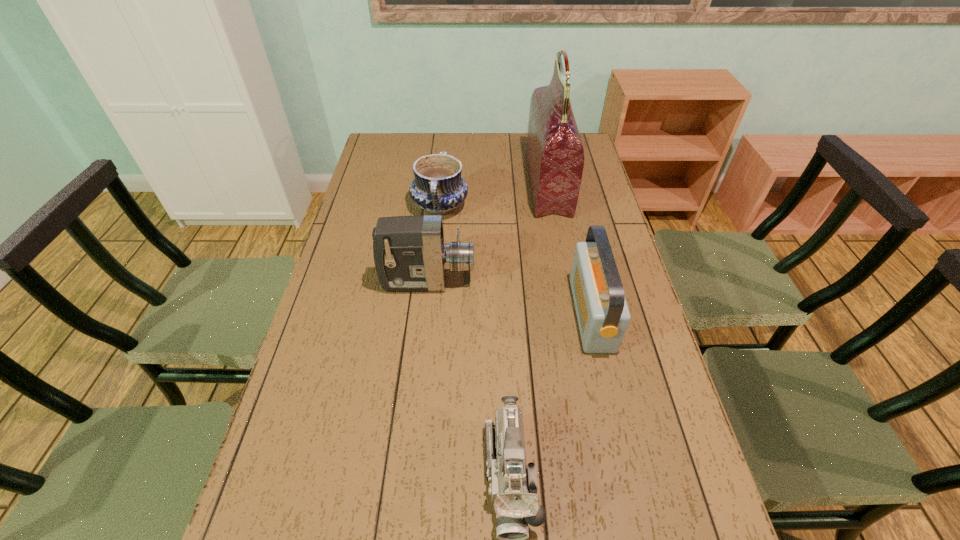
Identify the location of vacant space located 0.200m on the front-facing side of the radio receiver. (504, 314).

In order to click on vacant space located on the front-facing side of the radio receiver in this screenshot , I will do `click(450, 314)`.

The height and width of the screenshot is (540, 960). In order to click on vacant space situated 0.230m on the front of the pottery in this screenshot , I will do `click(433, 277)`.

You are a GUI agent. You are given a task and a screenshot of the screen. Output one action in this format:
    pyautogui.click(x=<x>, y=<y>)
    Task: Click on the object that is at the far edge
    
    Given the screenshot: What is the action you would take?
    pyautogui.click(x=555, y=155)

The height and width of the screenshot is (540, 960). I want to click on object that is at the left edge, so click(410, 255).

The width and height of the screenshot is (960, 540). I want to click on handbag situated at the right edge, so click(555, 155).

Identify the location of radio receiver located in the right edge section of the desktop. This screenshot has width=960, height=540. (603, 315).

Image resolution: width=960 pixels, height=540 pixels. What are the coordinates of `object located at the far right corner` in the screenshot? It's located at (555, 155).

Find the location of a particular element. free region at the far edge of the desktop is located at coordinates (413, 163).

Image resolution: width=960 pixels, height=540 pixels. I want to click on vacant point at the left edge, so click(x=292, y=406).